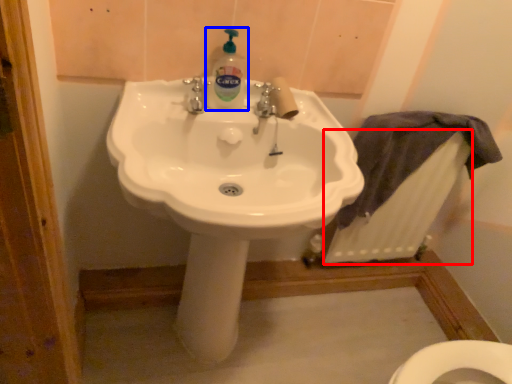
Question: Among these objects, which one is nearest to the camera, radiator (highlighted by a red box) or cleaning product (highlighted by a blue box)?

Choices:
 (A) radiator
 (B) cleaning product

Answer: (B)